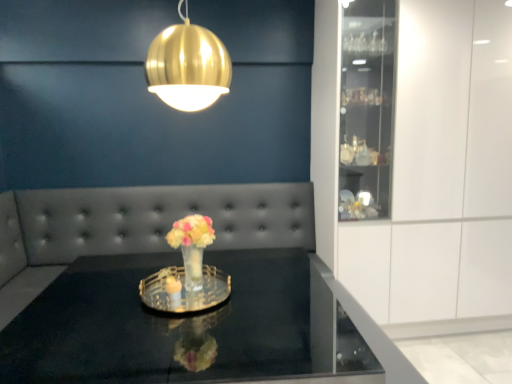
Identify the location of vacant area located to the right-hand side of clear glass tray at center. The width and height of the screenshot is (512, 384). (263, 299).